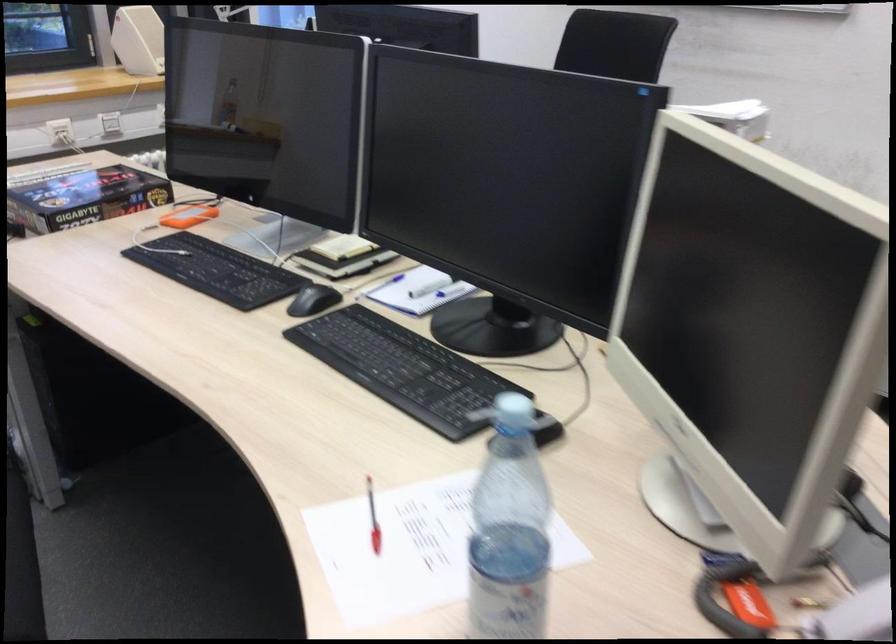
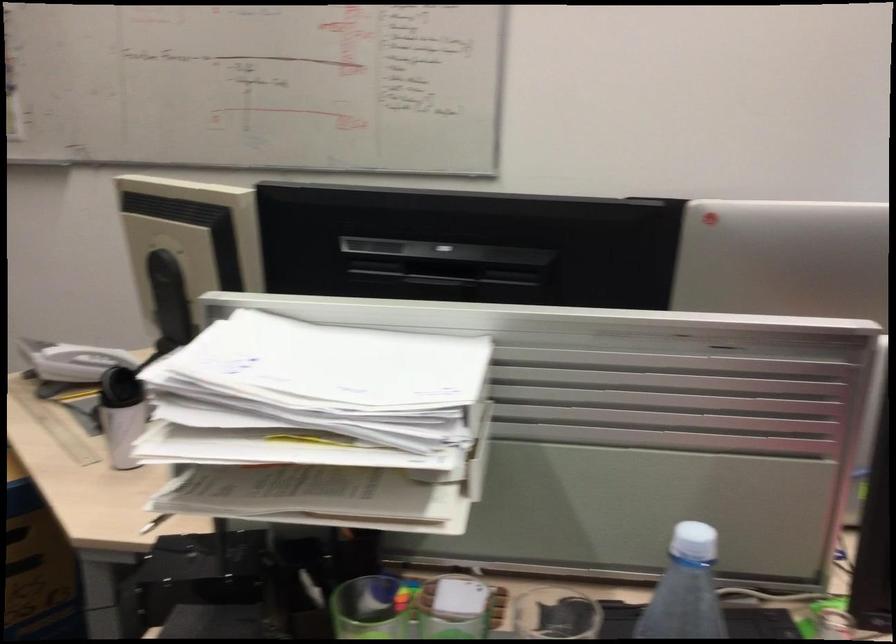
Question: I am providing you with two images of the same scene from different viewpoints. After the viewpoint changes to image2, which objects are now occluded?

Choices:
 (A) white smartphone
 (B) blue bottle cap
 (C) green pen holder
 (D) yellow tennis ball can

Answer: (B)